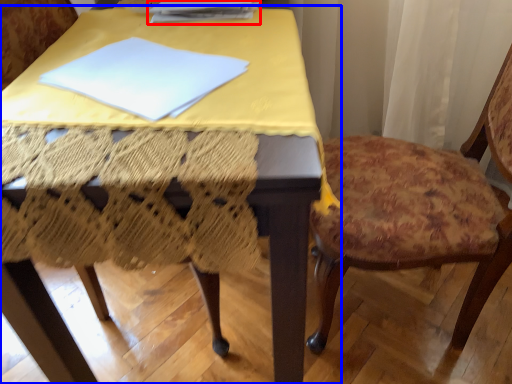
Question: Which point is further to the camera, paperback book (highlighted by a red box) or table (highlighted by a blue box)?

Choices:
 (A) paperback book
 (B) table

Answer: (A)